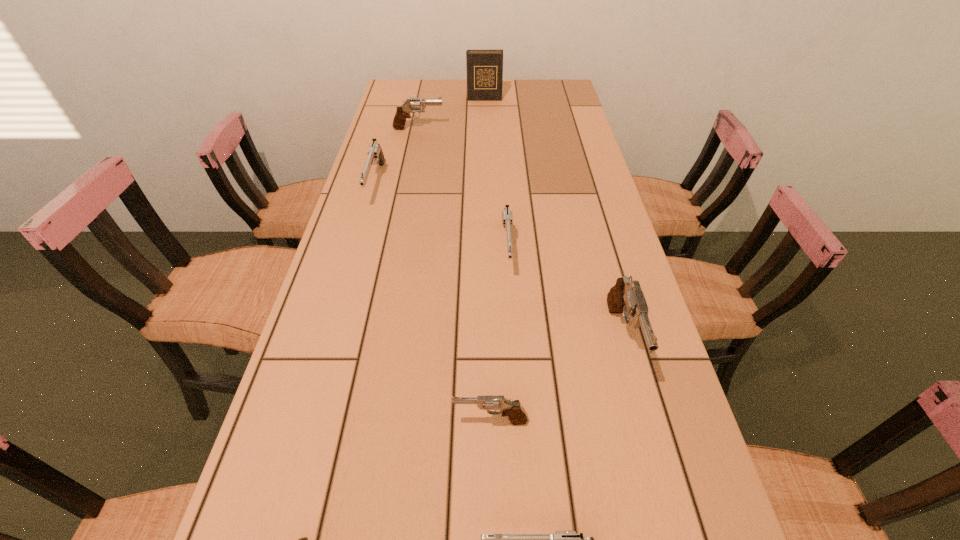
You are a GUI agent. You are given a task and a screenshot of the screen. Output one action in this format:
    pyautogui.click(x=<x>, y=<y>)
    Task: Click on the fifth farthest pistol
    The image size is (960, 540).
    Given the screenshot: What is the action you would take?
    pyautogui.click(x=517, y=415)

This screenshot has height=540, width=960. I want to click on the second gray pistol from right to left, so click(x=517, y=415).

At what (x,y) coordinates should I click in order to perform the action: click on free space located 0.290m on the front cover of the farthest object. Please return your answer as a coordinate pair (x, y). This screenshot has height=540, width=960. Looking at the image, I should click on (485, 138).

Identify the location of vacant space located at the barrel of the second nearest gray pistol. This screenshot has height=540, width=960. (655, 453).

At what (x,y) coordinates should I click in order to perform the action: click on vacant position located at the barrel of the farthest pistol. Please return your answer as a coordinate pair (x, y). Looking at the image, I should click on (492, 129).

Find the location of a particular element. The height and width of the screenshot is (540, 960). free location located on the front-facing side of the leftmost silver pistol is located at coordinates (355, 256).

Find the location of a particular element. vacant space located on the front-facing side of the third farthest pistol is located at coordinates (513, 347).

Find the location of a particular element. The height and width of the screenshot is (540, 960). free spot located at the barrel of the second gray pistol from left to right is located at coordinates (420, 421).

I want to click on vacant area situated at the barrel of the second gray pistol from left to right, so click(x=344, y=421).

This screenshot has height=540, width=960. Identify the location of vacant space located at the barrel of the second gray pistol from left to right. [x=316, y=421].